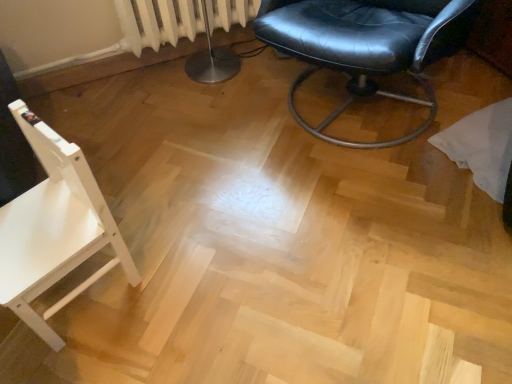
Locate an element on the screen. This screenshot has width=512, height=384. vacant area situated to the left side of black leather chair at center, the 1th chair when ordered from right to left is located at coordinates (199, 135).